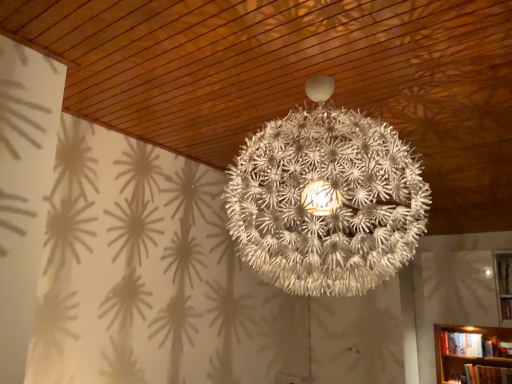
Question: Considering the positions of white matte spherical lamp at center and hardcover book at lower right in the image, is white matte spherical lamp at center taller or shorter than hardcover book at lower right?

Choices:
 (A) tall
 (B) short

Answer: (A)

Question: From a real-world perspective, is white matte spherical lamp at center physically located above or below hardcover book at lower right?

Choices:
 (A) above
 (B) below

Answer: (A)

Question: Is white matte spherical lamp at center inside the boundaries of hardcover book at lower right, or outside?

Choices:
 (A) inside
 (B) outside

Answer: (B)

Question: Looking at their shapes, would you say hardcover book at lower right is wider or thinner than white matte spherical lamp at center?

Choices:
 (A) thin
 (B) wide

Answer: (A)

Question: Would you say hardcover book at lower right is inside or outside white matte spherical lamp at center?

Choices:
 (A) outside
 (B) inside

Answer: (A)

Question: Is hardcover book at lower right taller or shorter than white matte spherical lamp at center?

Choices:
 (A) tall
 (B) short

Answer: (B)

Question: In terms of size, does hardcover book at lower right appear bigger or smaller than white matte spherical lamp at center?

Choices:
 (A) big
 (B) small

Answer: (B)